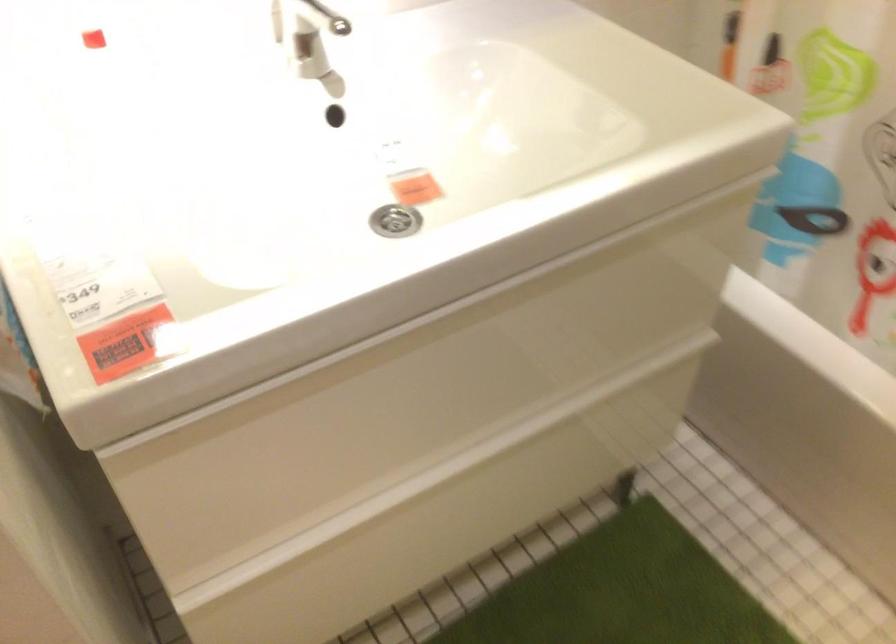
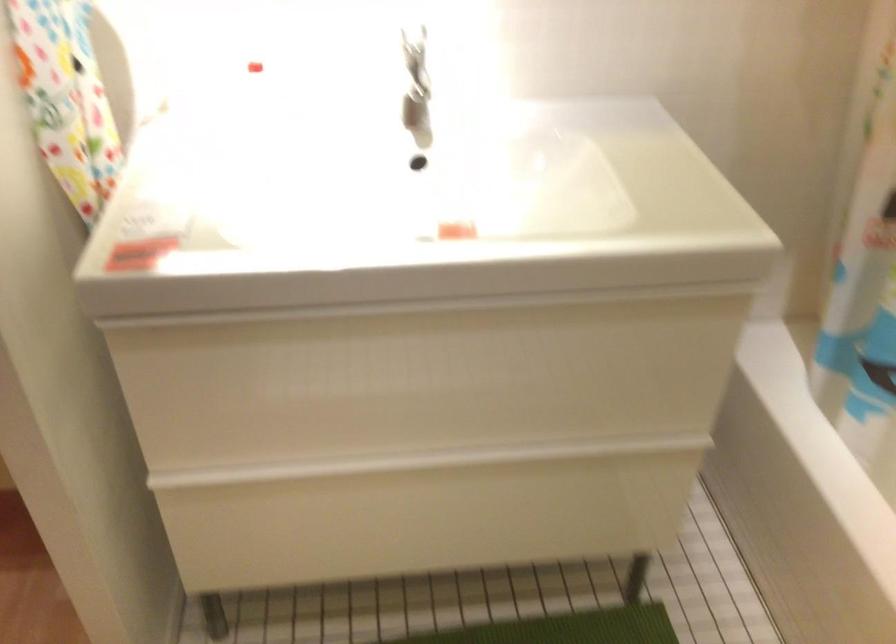
Question: The camera is either moving clockwise (left) or counter-clockwise (right) around the object. The first image is from the beginning of the video and the second image is from the end. Is the camera moving left or right when shooting the video?

Choices:
 (A) Left
 (B) Right

Answer: (B)